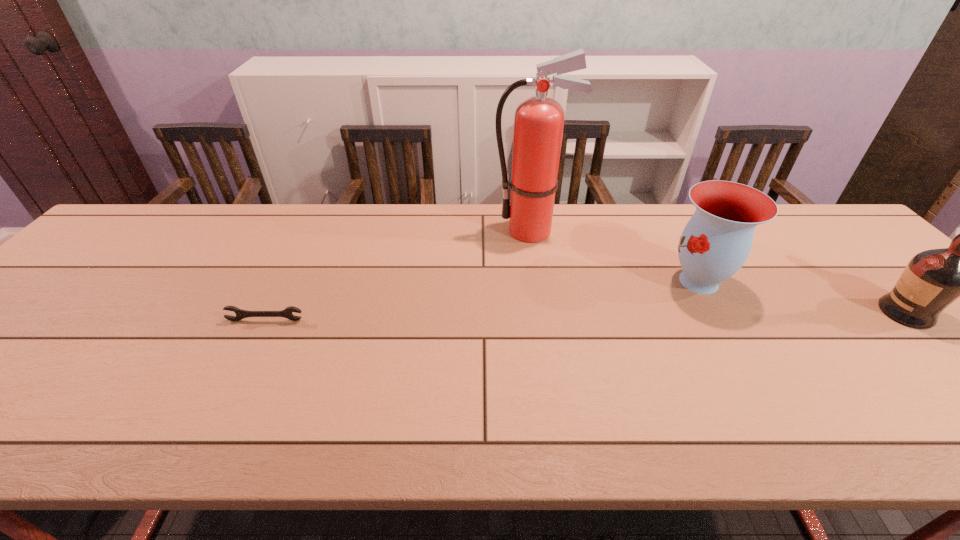
What are the coordinates of `blank space located on the hose direction of the third object from right to left` in the screenshot? It's located at (449, 231).

Find the location of a particular element. This screenshot has height=540, width=960. vacant space located on the surface of the liquor is located at coordinates (762, 313).

This screenshot has width=960, height=540. In order to click on vacant space situated on the surface of the liquor in this screenshot , I will do pyautogui.click(x=779, y=313).

Where is `free point located 0.260m on the surface of the liquor`? This screenshot has width=960, height=540. free point located 0.260m on the surface of the liquor is located at coordinates (775, 313).

Locate an element on the screen. free space located on the front of the second shortest object is located at coordinates (721, 321).

The width and height of the screenshot is (960, 540). I want to click on vacant area located on the open ends of the shortest object, so click(x=255, y=341).

Where is `object that is at the far edge`? object that is at the far edge is located at coordinates (539, 120).

Identify the location of object located at the right edge. (933, 279).

Find the location of `vacant region at the far edge of the desktop`. vacant region at the far edge of the desktop is located at coordinates (780, 221).

Identify the location of free space at the near edge. coord(77,416).